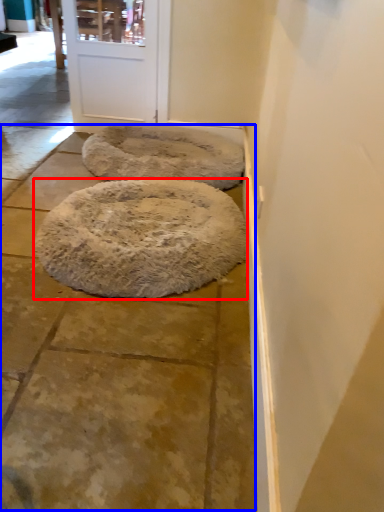
Question: Which of the following is the closest to the observer, dog bed (highlighted by a red box) or pavement (highlighted by a blue box)?

Choices:
 (A) dog bed
 (B) pavement

Answer: (B)